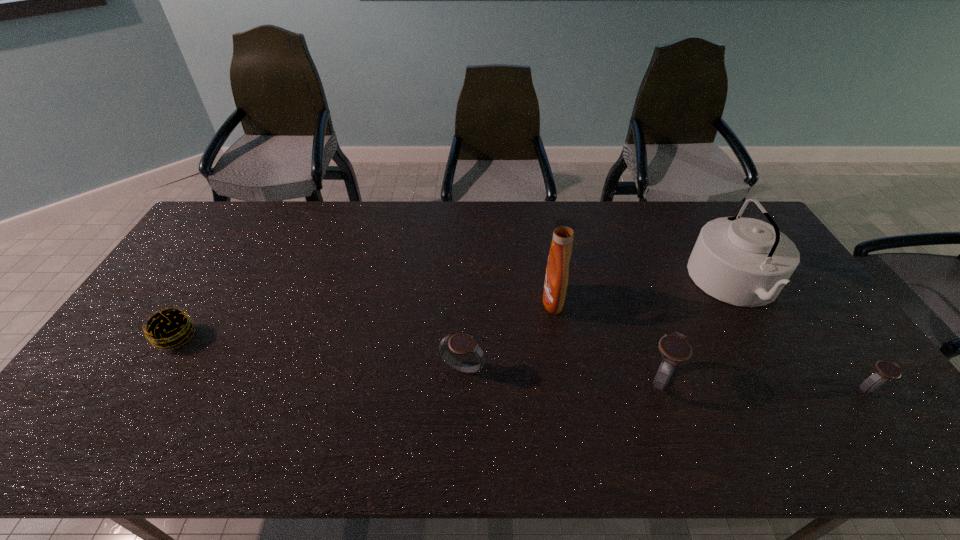
Find the location of a particular element. Image resolution: width=960 pixels, height=540 pixels. the second object from left to right is located at coordinates (462, 343).

Identify the location of the fourth tallest object. The height and width of the screenshot is (540, 960). (462, 343).

Identify the location of the second watch from right to left. pos(674,348).

At what (x,y) coordinates should I click in order to perform the action: click on the third tallest object. Please return your answer as a coordinate pair (x, y). The height and width of the screenshot is (540, 960). Looking at the image, I should click on (674, 348).

Find the location of `the rightmost watch`. the rightmost watch is located at coordinates (884, 370).

This screenshot has height=540, width=960. Find the location of `kettle`. kettle is located at coordinates pos(746,262).

Locate an element on the screen. The width and height of the screenshot is (960, 540). the third object from left to right is located at coordinates [x=557, y=272].

In order to click on the leftmost object in this screenshot , I will do `click(168, 328)`.

You are a GUI agent. You are given a task and a screenshot of the screen. Output one action in this format:
    pyautogui.click(x=<x>, y=<y>)
    Task: Click on the free space located 0.390m on the back of the leftmost watch
    
    Given the screenshot: What is the action you would take?
    pyautogui.click(x=467, y=260)

Where is `vacant area located 0.070m on the left of the fourth object from left to right`? The height and width of the screenshot is (540, 960). vacant area located 0.070m on the left of the fourth object from left to right is located at coordinates (614, 379).